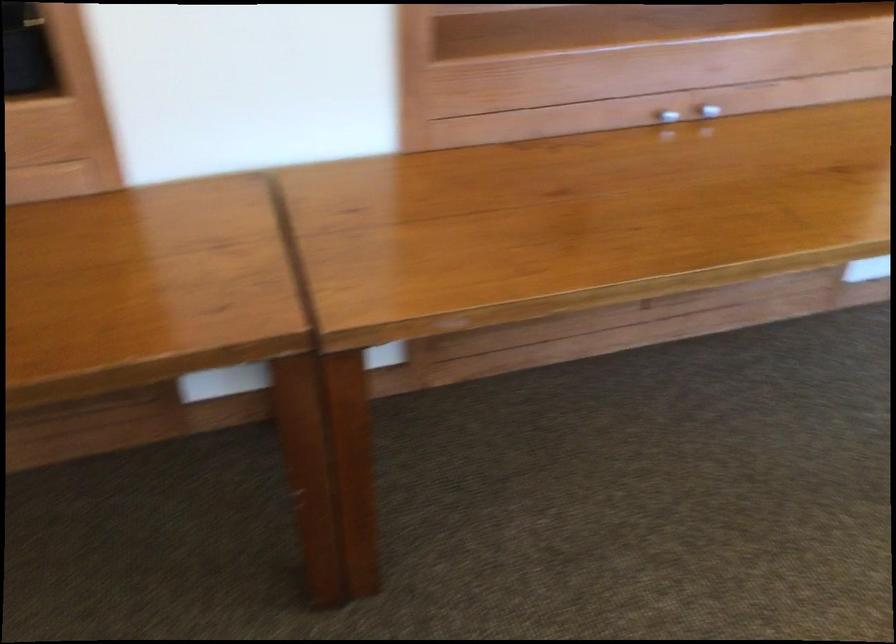
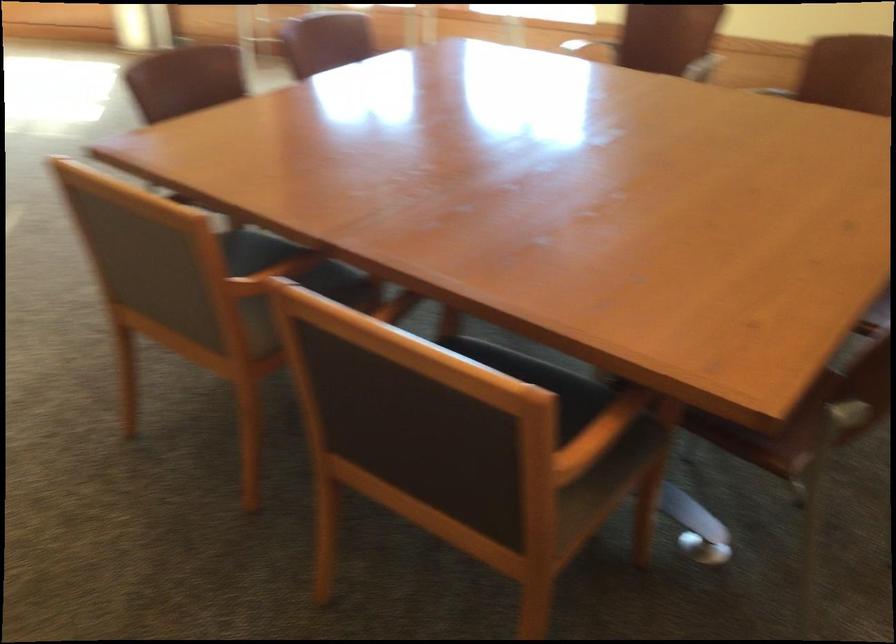
The images are taken continuously from a first-person perspective. In which direction is your viewpoint rotating?

The camera rotated toward right-down.